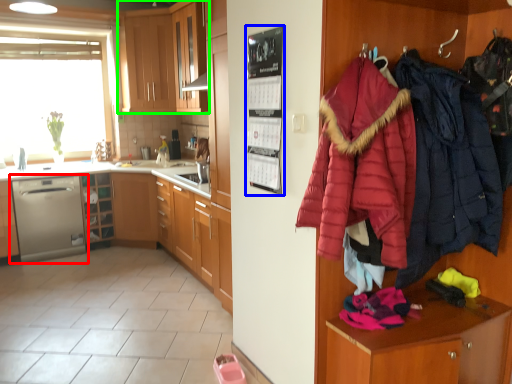
Question: Estimate the real-world distances between objects in this image. Which object is closer to dishwasher (highlighted by a red box), bulletin board (highlighted by a blue box) or cabinetry (highlighted by a green box)?

Choices:
 (A) bulletin board
 (B) cabinetry

Answer: (B)